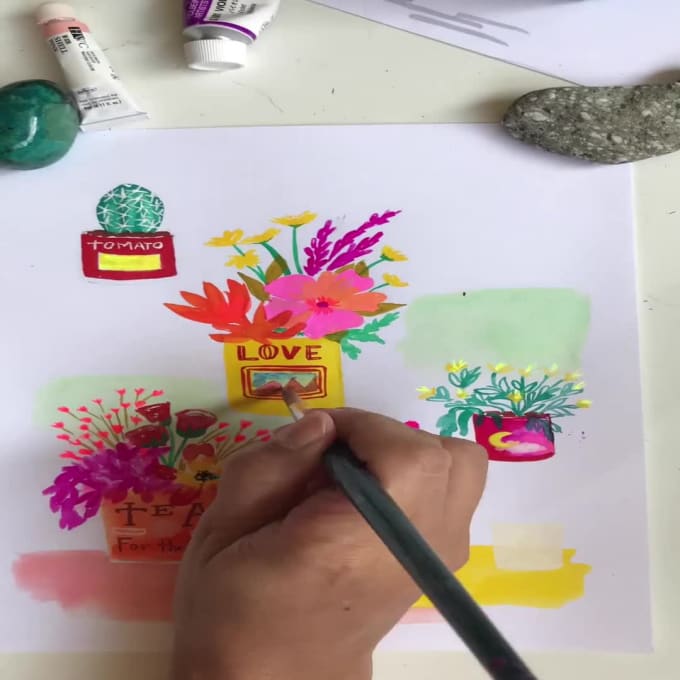
At what (x,y) coordinates should I click in order to perform the action: click on yellow paint. Please return your answer as a coordinate pair (x, y). The image size is (680, 680). Looking at the image, I should click on (503, 595).